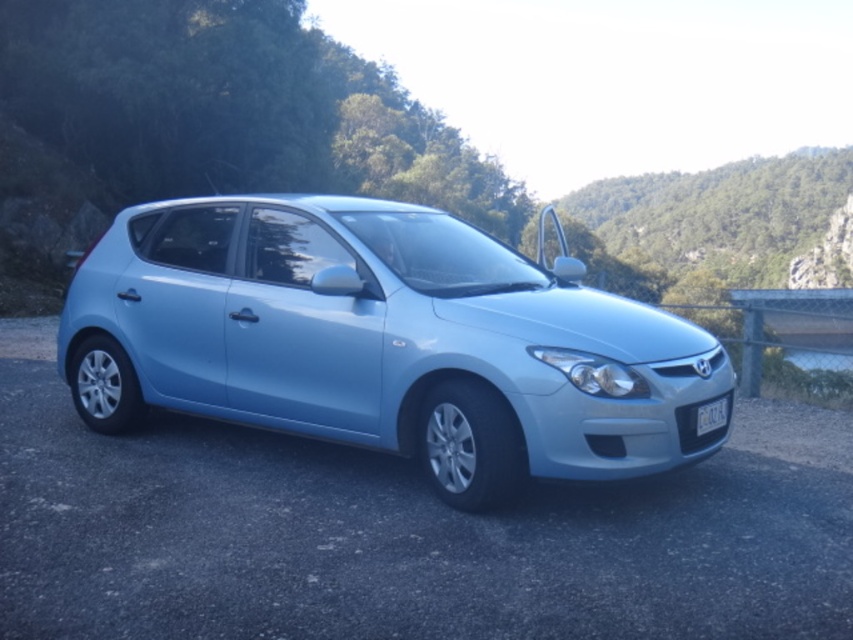
Who is shorter, satin light blue car at center or white plastic license plate at center?

Standing shorter between the two is white plastic license plate at center.

Locate an element on the screen. satin light blue car at center is located at coordinates (383, 340).